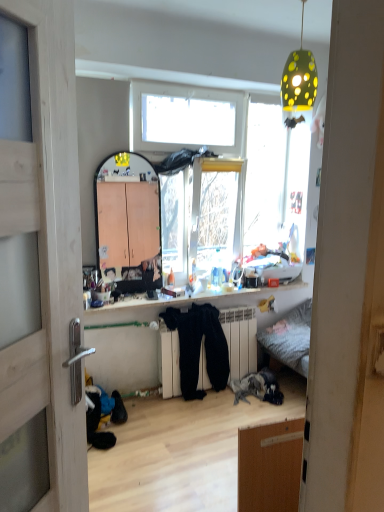
Describe the element at coordinates (212, 300) in the screenshot. I see `shiny plastic shelf at center` at that location.

The image size is (384, 512). Find the location of `white matte radiator at center`. white matte radiator at center is located at coordinates (240, 340).

You are a GUI agent. You are given a task and a screenshot of the screen. Output one action in this format:
    pyautogui.click(x=<x>, y=<y>)
    Task: Click on the green dotted lampshade at upper center
    
    Given the screenshot: What is the action you would take?
    pyautogui.click(x=298, y=85)

From the image's perspective, between wooden door at left and green dotted lampshade at upper center, who is located below?

wooden door at left is shown below in the image.

Between point (22, 455) and point (299, 103), which one is positioned in front?

The point (22, 455) is in front.

Is wooden door at left beside green dotted lampshade at upper center?

No.

From a real-world perspective, does wooden door at left stand above green dotted lampshade at upper center?

No, from a real-world perspective, wooden door at left is not on top of green dotted lampshade at upper center.

Considering the sizes of objects wooden door at left and white matte radiator at center in the image provided, who is taller, wooden door at left or white matte radiator at center?

With more height is wooden door at left.

This screenshot has width=384, height=512. Find the location of `radiator below the wooden door at left (from a real-world perspective)`. radiator below the wooden door at left (from a real-world perspective) is located at coordinates (240, 340).

From a real-world perspective, is wooden door at left over white matte radiator at center?

Yes, from a real-world perspective, wooden door at left is above white matte radiator at center.

Which object is closer to the camera taking this photo, wooden door at left or white matte radiator at center?

wooden door at left is more forward.

Considering the relative sizes of green dotted lampshade at upper center and white matte radiator at center in the image provided, is green dotted lampshade at upper center taller than white matte radiator at center?

Incorrect, the height of green dotted lampshade at upper center is not larger of that of white matte radiator at center.

Is green dotted lampshade at upper center looking in the opposite direction of white matte radiator at center?

No, green dotted lampshade at upper center is not facing the opposite direction of white matte radiator at center.

How distant is white matte radiator at center from green dotted lampshade at upper center?

A distance of 6.03 feet exists between white matte radiator at center and green dotted lampshade at upper center.

Is white matte radiator at center oriented towards green dotted lampshade at upper center?

No, white matte radiator at center is not oriented towards green dotted lampshade at upper center.

Which object is more forward, white matte radiator at center or green dotted lampshade at upper center?

green dotted lampshade at upper center is in front.

Considering the relative sizes of white matte radiator at center and green dotted lampshade at upper center in the image provided, is white matte radiator at center shorter than green dotted lampshade at upper center?

In fact, white matte radiator at center may be taller than green dotted lampshade at upper center.

Considering the points (138, 308) and (291, 101), which point is in front, point (138, 308) or point (291, 101)?

The point (291, 101) is in front.

Could you tell me if shiny plastic shelf at center is facing green dotted lampshade at upper center?

No, shiny plastic shelf at center is not turned towards green dotted lampshade at upper center.

Is shiny plastic shelf at center at the right side of green dotted lampshade at upper center?

Incorrect, shiny plastic shelf at center is not on the right side of green dotted lampshade at upper center.

Does shiny plastic shelf at center have a lesser height compared to green dotted lampshade at upper center?

Yes, shiny plastic shelf at center is shorter than green dotted lampshade at upper center.

Is shiny plastic shelf at center positioned behind wooden door at left?

That is True.

From the image's perspective, which is below, shiny plastic shelf at center or wooden door at left?

From the image's view, shiny plastic shelf at center is below.

Could you tell me if shiny plastic shelf at center is facing wooden door at left?

No, shiny plastic shelf at center is not oriented towards wooden door at left.

Who is smaller, shiny plastic shelf at center or wooden door at left?

shiny plastic shelf at center is smaller.

There is a shiny plastic shelf at center. Where is `door above it (from a real-world perspective)`? The image size is (384, 512). door above it (from a real-world perspective) is located at coordinates (39, 261).

From the image's perspective, does wooden door at left appear higher than shiny plastic shelf at center?

Correct, wooden door at left appears higher than shiny plastic shelf at center in the image.

At what (x,y) coordinates should I click in order to perform the action: click on light fixture positioned vertically above the wooden door at left (from a real-world perspective). Please return your answer as a coordinate pair (x, y). The width and height of the screenshot is (384, 512). Looking at the image, I should click on (298, 85).

This screenshot has width=384, height=512. I want to click on radiator behind the wooden door at left, so click(x=240, y=340).

Estimate the real-world distances between objects in this image. Which object is closer to shiny plastic shelf at center, green dotted lampshade at upper center or white matte radiator at center?

white matte radiator at center is closer to shiny plastic shelf at center.

Looking at the image, which one is located further to shiny plastic shelf at center, white matte radiator at center or wooden door at left?

wooden door at left is further to shiny plastic shelf at center.

Which object lies further to the anchor point green dotted lampshade at upper center, shiny plastic shelf at center or wooden door at left?

Based on the image, wooden door at left appears to be further to green dotted lampshade at upper center.

Considering their positions, is wooden door at left positioned further to shiny plastic shelf at center than white matte radiator at center?

wooden door at left.

When comparing their distances from white matte radiator at center, does shiny plastic shelf at center or green dotted lampshade at upper center seem closer?

shiny plastic shelf at center is positioned closer to the anchor white matte radiator at center.

Looking at the image, which one is located closer to white matte radiator at center, wooden door at left or green dotted lampshade at upper center?

green dotted lampshade at upper center lies closer to white matte radiator at center than the other object.

From the image, which object appears to be farther from wooden door at left, green dotted lampshade at upper center or shiny plastic shelf at center?

green dotted lampshade at upper center is further to wooden door at left.

Based on their spatial positions, is shiny plastic shelf at center or wooden door at left further from white matte radiator at center?

Among the two, wooden door at left is located further to white matte radiator at center.

Locate an element on the screen. counter top between green dotted lampshade at upper center and white matte radiator at center vertically is located at coordinates (212, 300).

What are the coordinates of `light fixture located between wooden door at left and shiny plastic shelf at center in the depth direction` in the screenshot? It's located at (298, 85).

At what (x,y) coordinates should I click in order to perform the action: click on light fixture between wooden door at left and white matte radiator at center in the front-back direction. Please return your answer as a coordinate pair (x, y). The width and height of the screenshot is (384, 512). Looking at the image, I should click on (298, 85).

The width and height of the screenshot is (384, 512). Identify the location of counter top positioned between wooden door at left and white matte radiator at center from near to far. coord(212,300).